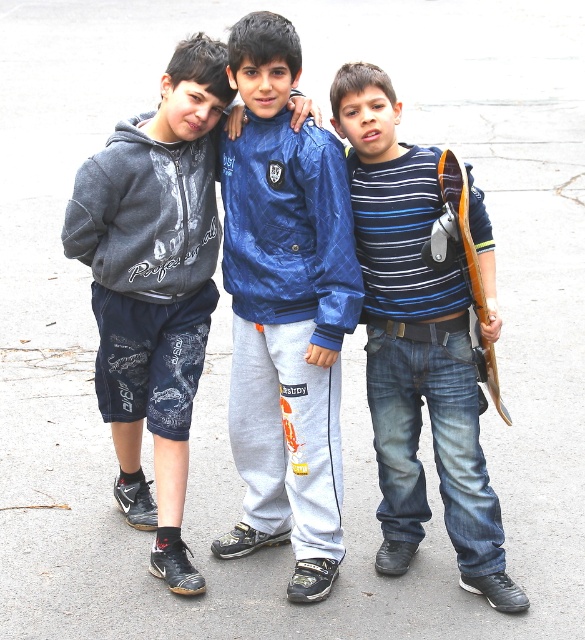
Question: Which point appears farthest from the camera in this image?

Choices:
 (A) (277, 161)
 (B) (143, 193)
 (C) (414, 378)

Answer: (C)

Question: Which of the following is the farthest from the observer?

Choices:
 (A) blue striped shirt at center
 (B) wooden skateboard at right
 (C) dark gray hoodie at center
 (D) blue shiny jacket at center

Answer: (C)

Question: Which of the following is the closest to the observer?

Choices:
 (A) (180, 118)
 (B) (473, 344)

Answer: (B)

Question: Is blue shiny jacket at center further to the viewer compared to blue striped shirt at center?

Choices:
 (A) yes
 (B) no

Answer: (A)

Question: Where is blue shiny jacket at center located in relation to dark gray hoodie at center in the image?

Choices:
 (A) left
 (B) right

Answer: (B)

Question: Is dark gray hoodie at center smaller than blue striped shirt at center?

Choices:
 (A) no
 (B) yes

Answer: (A)